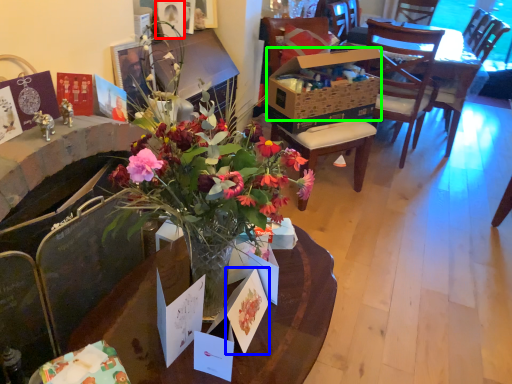
Question: Estimate the real-world distances between objects in this image. Which object is farther from picture frame (highlighted by a red box), postcard (highlighted by a blue box) or box (highlighted by a green box)?

Choices:
 (A) postcard
 (B) box

Answer: (A)